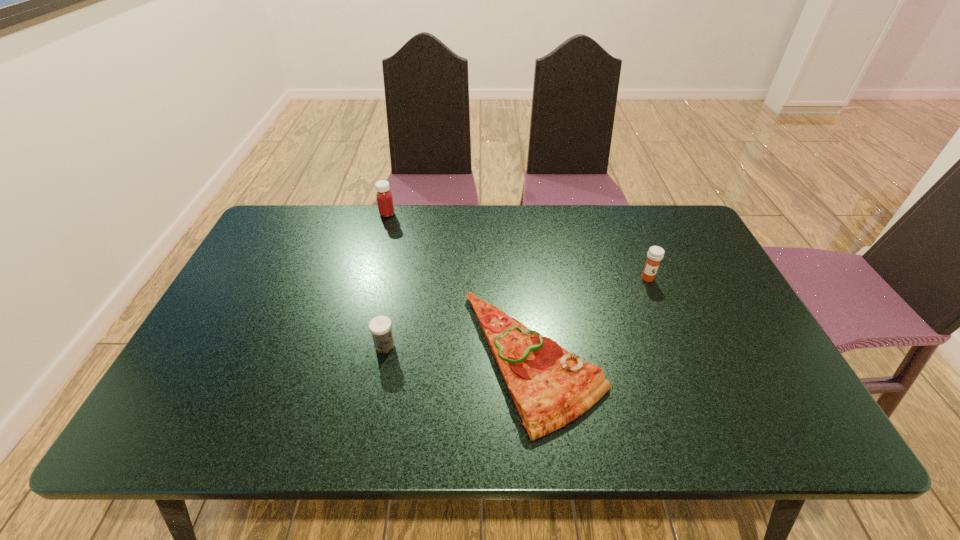
The image size is (960, 540). I want to click on the leftmost object, so click(384, 197).

Where is `the leftmost medicine`? The height and width of the screenshot is (540, 960). the leftmost medicine is located at coordinates (384, 197).

At what (x,y) coordinates should I click in order to perform the action: click on the rightmost medicine. Please return your answer as a coordinate pair (x, y). Image resolution: width=960 pixels, height=540 pixels. Looking at the image, I should click on (655, 254).

At what (x,y) coordinates should I click in order to perform the action: click on the second nearest medicine. Please return your answer as a coordinate pair (x, y). Looking at the image, I should click on (655, 254).

Locate an element on the screen. This screenshot has height=540, width=960. the nearest medicine is located at coordinates (380, 326).

You are a GUI agent. You are given a task and a screenshot of the screen. Output one action in this format:
    pyautogui.click(x=<x>, y=<y>)
    Task: Click on the third tallest object
    The image size is (960, 540).
    Given the screenshot: What is the action you would take?
    pyautogui.click(x=380, y=326)

Where is `the second object from right to left`? The image size is (960, 540). the second object from right to left is located at coordinates (550, 387).

Identify the location of the shortest object. The height and width of the screenshot is (540, 960). (550, 387).

This screenshot has width=960, height=540. In order to click on blank area located on the front of the farthest object in this screenshot , I will do pos(368,288).

The width and height of the screenshot is (960, 540). Find the location of `vacant space located on the label side of the third shortest object`. vacant space located on the label side of the third shortest object is located at coordinates (686, 373).